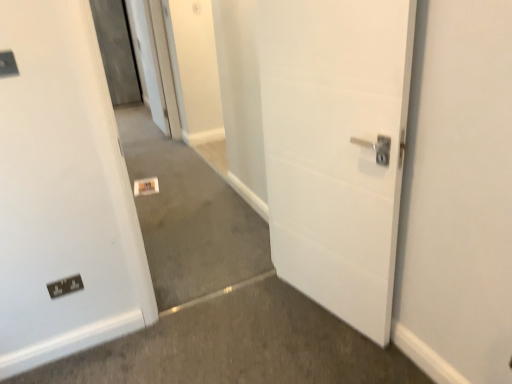
Question: Is matte black switch at upper left at the back of black plastic electric outlet at lower left?

Choices:
 (A) no
 (B) yes

Answer: (A)

Question: Is black plastic electric outlet at lower left positioned beyond the bounds of matte black switch at upper left?

Choices:
 (A) no
 (B) yes

Answer: (B)

Question: From a real-world perspective, is black plastic electric outlet at lower left below matte black switch at upper left?

Choices:
 (A) no
 (B) yes

Answer: (B)

Question: Is black plastic electric outlet at lower left facing towards matte black switch at upper left?

Choices:
 (A) yes
 (B) no

Answer: (B)

Question: Can you confirm if black plastic electric outlet at lower left is wider than matte black switch at upper left?

Choices:
 (A) yes
 (B) no

Answer: (B)

Question: Is black plastic electric outlet at lower left touching matte black switch at upper left?

Choices:
 (A) no
 (B) yes

Answer: (A)

Question: Considering the relative sizes of matte black switch at upper left and black plastic electric outlet at lower left in the image provided, is matte black switch at upper left shorter than black plastic electric outlet at lower left?

Choices:
 (A) no
 (B) yes

Answer: (B)

Question: From a real-world perspective, does matte black switch at upper left stand above black plastic electric outlet at lower left?

Choices:
 (A) no
 (B) yes

Answer: (B)

Question: Can you confirm if matte black switch at upper left is bigger than black plastic electric outlet at lower left?

Choices:
 (A) no
 (B) yes

Answer: (A)

Question: Is matte black switch at upper left thinner than black plastic electric outlet at lower left?

Choices:
 (A) no
 (B) yes

Answer: (A)

Question: Is matte black switch at upper left completely or partially outside of black plastic electric outlet at lower left?

Choices:
 (A) yes
 (B) no

Answer: (A)

Question: Are matte black switch at upper left and black plastic electric outlet at lower left located far from each other?

Choices:
 (A) yes
 (B) no

Answer: (B)

Question: Considering the relative sizes of neutral carpet at center and black plastic electric outlet at lower left in the image provided, is neutral carpet at center bigger than black plastic electric outlet at lower left?

Choices:
 (A) yes
 (B) no

Answer: (A)